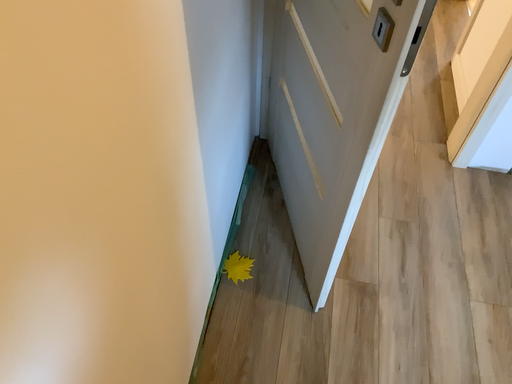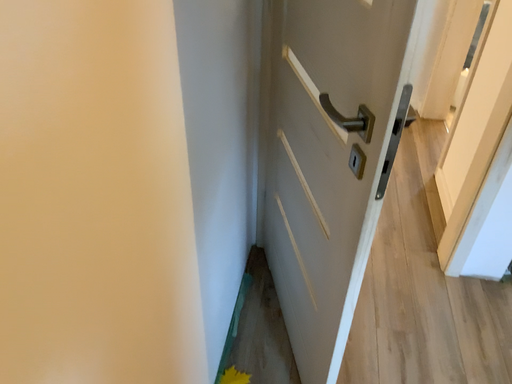
Question: Which way did the camera rotate in the video?

Choices:
 (A) rotated downward
 (B) rotated upward

Answer: (B)